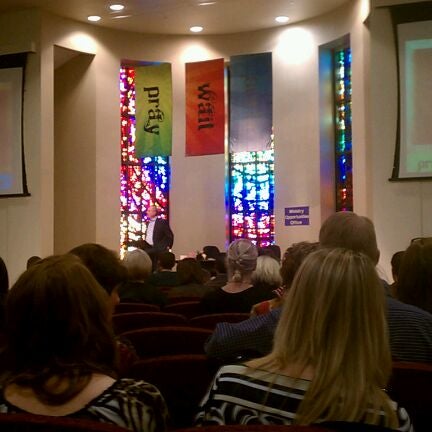
In order to click on tan wall in this screenshot , I will do `click(297, 92)`.